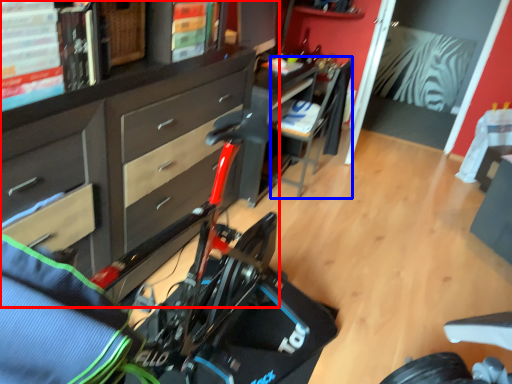
Question: Which of the following is the closest to the observer, cabinetry (highlighted by a red box) or chair (highlighted by a blue box)?

Choices:
 (A) cabinetry
 (B) chair

Answer: (A)